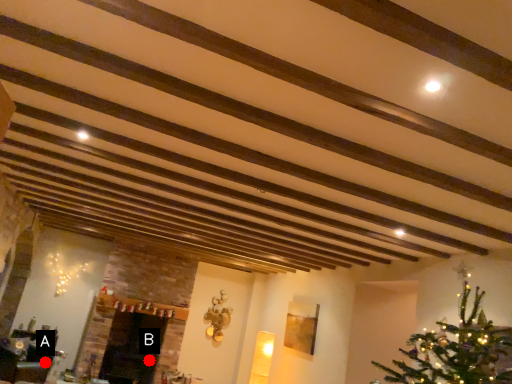
Question: Two points are circled on the image, labeled by A and B beside each circle. Which point is farther to the camera?

Choices:
 (A) A is further
 (B) B is further

Answer: (B)